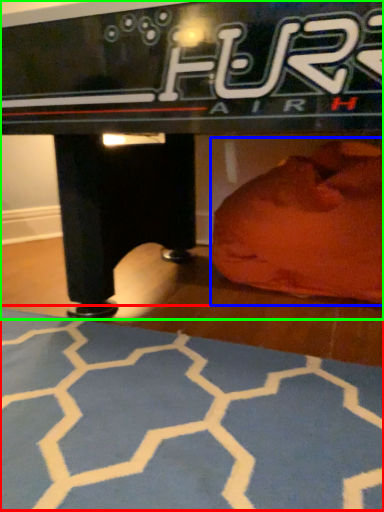
Question: Which is nearer to the yoga mat (highlighted by a red box)? bean bag chair (highlighted by a blue box) or table (highlighted by a green box).

Choices:
 (A) bean bag chair
 (B) table

Answer: (B)